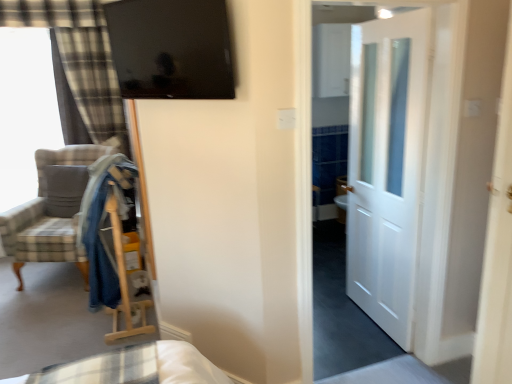
Question: Considering the relative positions of white wooden door at center, the 1th door from the front, and soft gray pillow at left in the image provided, is white wooden door at center, the 1th door from the front, to the right of soft gray pillow at left from the viewer's perspective?

Choices:
 (A) no
 (B) yes

Answer: (B)

Question: Is white wooden door at center, acting as the 2th door starting from the back, to the left of soft gray pillow at left from the viewer's perspective?

Choices:
 (A) no
 (B) yes

Answer: (A)

Question: Considering the relative sizes of white wooden door at center, the 1th door from the front, and soft gray pillow at left in the image provided, is white wooden door at center, the 1th door from the front, taller than soft gray pillow at left?

Choices:
 (A) no
 (B) yes

Answer: (B)

Question: Is white wooden door at center, acting as the 2th door starting from the back, smaller than soft gray pillow at left?

Choices:
 (A) no
 (B) yes

Answer: (A)

Question: Can you confirm if white wooden door at center, the 1th door from the front, is shorter than soft gray pillow at left?

Choices:
 (A) no
 (B) yes

Answer: (A)

Question: From the image's perspective, is plaid fabric armchair at left located above or below plaid fabric curtain at left?

Choices:
 (A) below
 (B) above

Answer: (A)

Question: Considering the relative positions of plaid fabric armchair at left and plaid fabric curtain at left in the image provided, is plaid fabric armchair at left to the left or to the right of plaid fabric curtain at left?

Choices:
 (A) left
 (B) right

Answer: (B)

Question: Relative to plaid fabric curtain at left, is plaid fabric armchair at left in front or behind?

Choices:
 (A) front
 (B) behind

Answer: (A)

Question: Is plaid fabric armchair at left wider or thinner than plaid fabric curtain at left?

Choices:
 (A) thin
 (B) wide

Answer: (B)

Question: Does point (366, 54) appear closer or farther from the camera than point (65, 198)?

Choices:
 (A) farther
 (B) closer

Answer: (B)

Question: Looking at their shapes, would you say white glossy door at center, which appears as the second door when viewed from the front, is wider or thinner than soft gray pillow at left?

Choices:
 (A) thin
 (B) wide

Answer: (A)

Question: Considering their positions, is white glossy door at center, which appears as the second door when viewed from the front, located in front of or behind soft gray pillow at left?

Choices:
 (A) front
 (B) behind

Answer: (A)

Question: In terms of size, does white glossy door at center, the first door positioned from the back, appear bigger or smaller than soft gray pillow at left?

Choices:
 (A) small
 (B) big

Answer: (B)

Question: Is glossy black tv at upper center wider or thinner than plaid fabric armchair at left?

Choices:
 (A) thin
 (B) wide

Answer: (A)

Question: Considering the positions of glossy black tv at upper center and plaid fabric armchair at left in the image, is glossy black tv at upper center taller or shorter than plaid fabric armchair at left?

Choices:
 (A) short
 (B) tall

Answer: (A)